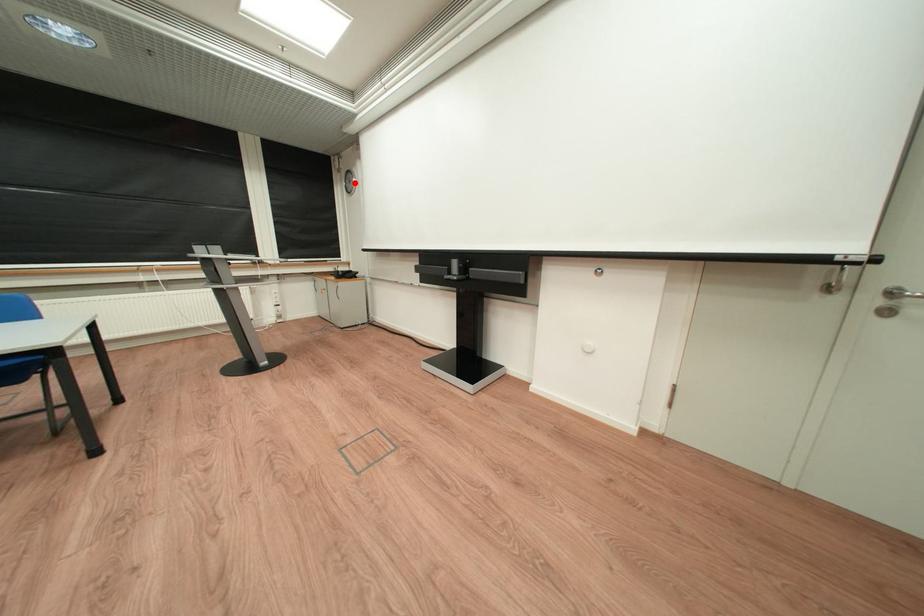
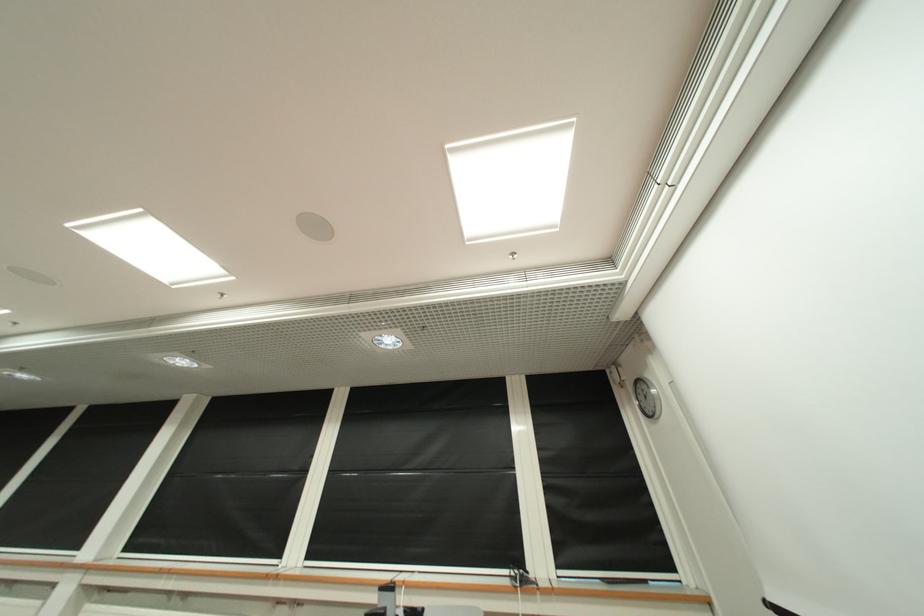
Question: I am providing you with two images of the same scene from different viewpoints. Image1 has a red point marked. In image2, the corresponding 3D location appears at what relative position? Reply with the corresponding letter.

Choices:
 (A) Closer
 (B) Farther

Answer: (B)